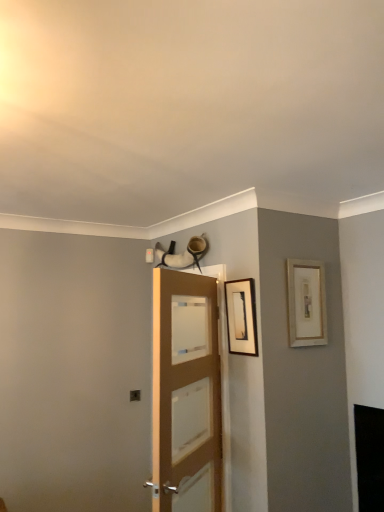
Question: From the image's perspective, relative to matte black picture frame at upper center, the 1th picture frame in the left-to-right sequence, is gold-framed picture at upper right, the second picture frame when ordered from left to right, above or below?

Choices:
 (A) above
 (B) below

Answer: (A)

Question: Considering the relative positions of gold-framed picture at upper right, which is counted as the 1th picture frame, starting from the right, and matte black picture frame at upper center, the 1th picture frame in the left-to-right sequence, in the image provided, is gold-framed picture at upper right, which is counted as the 1th picture frame, starting from the right, to the left or to the right of matte black picture frame at upper center, the 1th picture frame in the left-to-right sequence,?

Choices:
 (A) right
 (B) left

Answer: (A)

Question: Which of these objects is positioned farthest from the matte black picture frame at upper center, which is counted as the 2th picture frame, starting from the right?

Choices:
 (A) light brown wooden door at center
 (B) gold-framed picture at upper right, which is counted as the 1th picture frame, starting from the right

Answer: (A)

Question: Which object is positioned closest to the matte black picture frame at upper center, the 1th picture frame in the left-to-right sequence?

Choices:
 (A) gold-framed picture at upper right, which is counted as the 1th picture frame, starting from the right
 (B) light brown wooden door at center

Answer: (A)